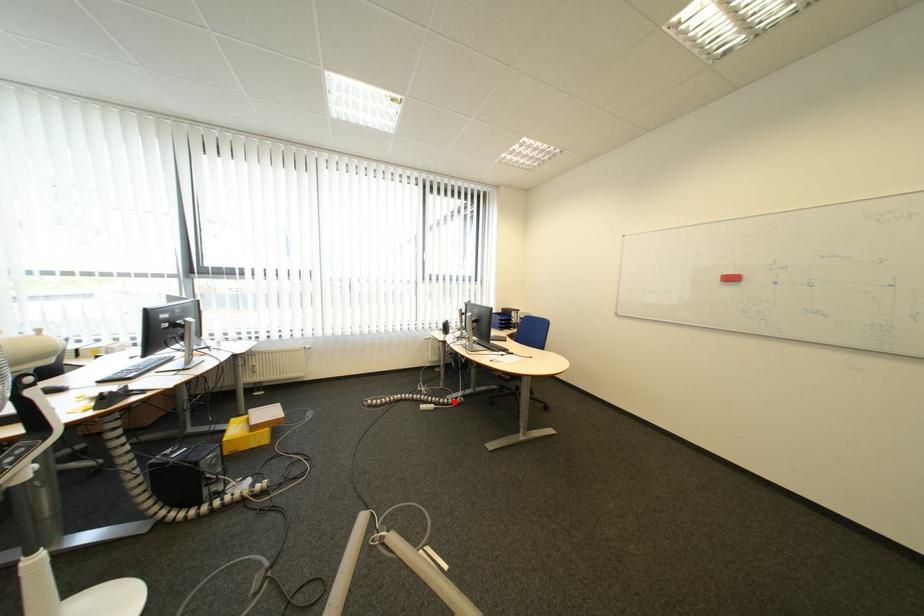
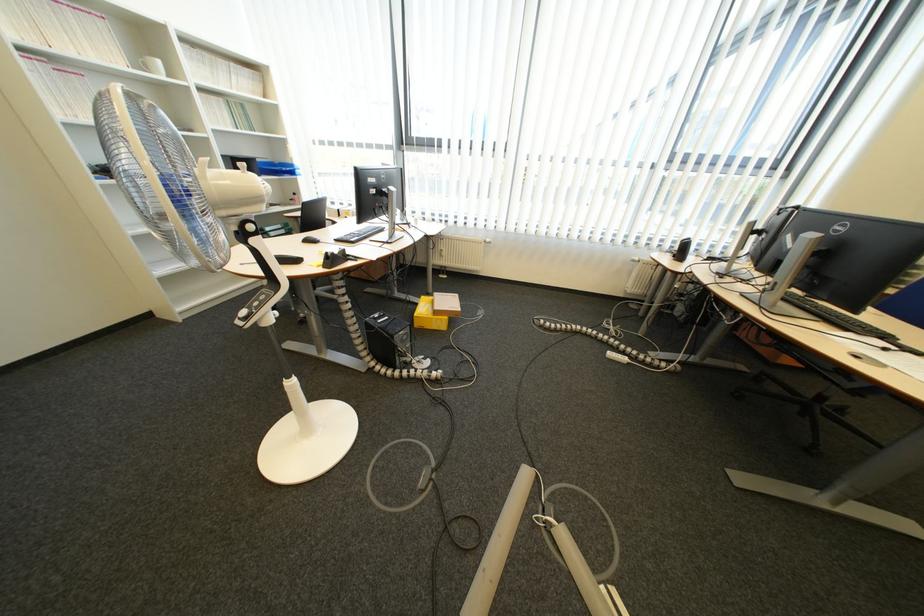
Question: I am providing you with two images of the same scene from different viewpoints. A red point is shown in image1. For the corresponding object point in image2, is it positioned nearer or farther from the camera?

Choices:
 (A) Nearer
 (B) Farther

Answer: (A)